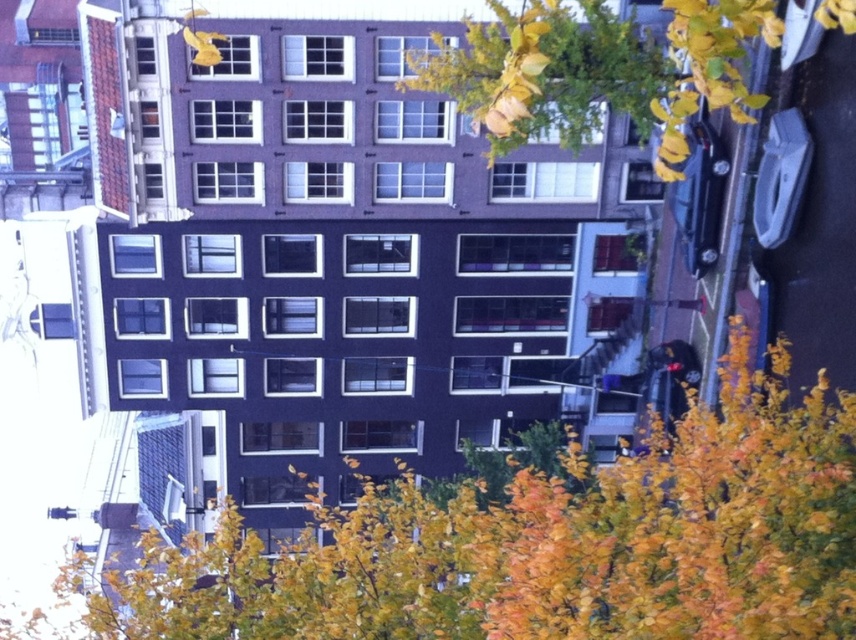
Question: Which point is farther to the camera?

Choices:
 (A) (395, 636)
 (B) (574, 48)

Answer: (B)

Question: Which object is closer to the camera taking this photo?

Choices:
 (A) yellow leafy tree at center
 (B) yellow-green foliage at upper right

Answer: (A)

Question: Does yellow leafy tree at center come in front of yellow-green foliage at upper right?

Choices:
 (A) yes
 (B) no

Answer: (A)

Question: Is yellow leafy tree at center closer to camera compared to yellow-green foliage at upper right?

Choices:
 (A) no
 (B) yes

Answer: (B)

Question: Is yellow leafy tree at center above yellow-green foliage at upper right?

Choices:
 (A) yes
 (B) no

Answer: (B)